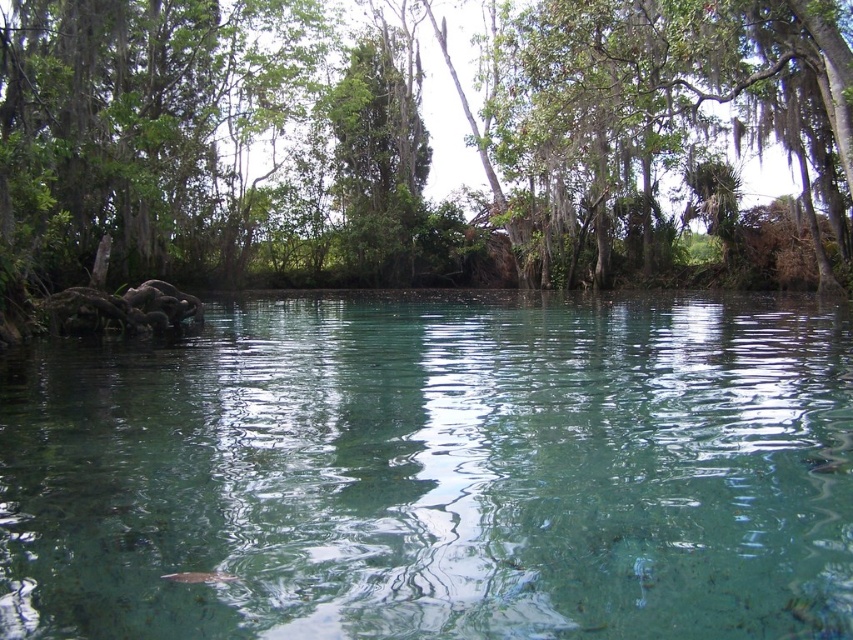
You are a photographer planning to capture the clear water at center and the green leafy tree at center in a single shot. Based on their sizes, which object should you focus on first if you want both to be in sharp focus?

The clear water at center has a smaller size compared to green leafy tree at center, so you should focus on the green leafy tree at center first to ensure both are in sharp focus.

You are standing at the edge of the scene and want to look at the clear water at center and the green leafy tree at center. Which object is closer to you?

The clear water at center is located below the green leafy tree at center, so the green leafy tree at center is closer to you.

You are standing at the edge of the scene and want to cross to the other side. The clear water at center and the green leafy tree at center are in your path. Which one do you need to navigate around first?

The clear water at center needs to be navigated around first because its width is less than the green leafy tree at center, meaning it is closer to you.